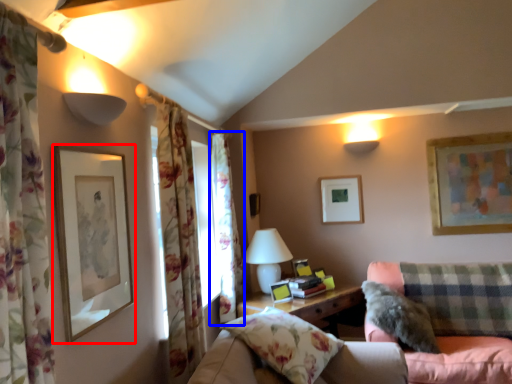
Question: Which object is further to the camera taking this photo, picture frame (highlighted by a red box) or curtain (highlighted by a blue box)?

Choices:
 (A) picture frame
 (B) curtain

Answer: (B)